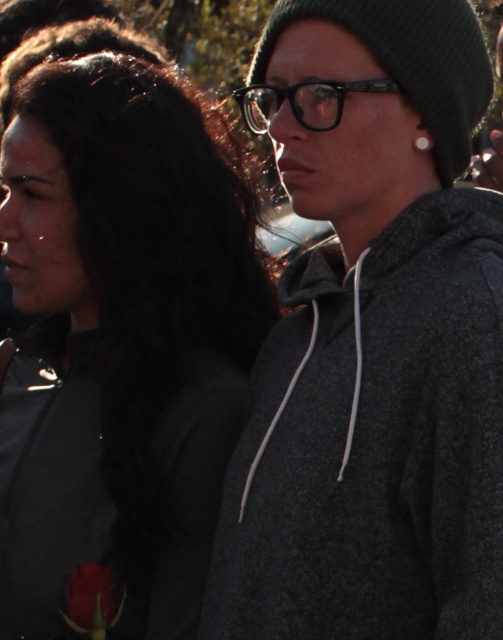
You are a photographer adjusting your camera settings to capture the matte red rose at lower left and the silver metallic earring at upper center in the same frame. Given their distance apart, will you need to adjust the zoom to ensure both are fully visible without cropping?

The matte red rose at lower left and silver metallic earring at upper center are 6.20 feet apart. To capture both in the same frame without cropping, the photographer may need to adjust the zoom to a wider angle to accommodate the distance between them.

You are a photographer adjusting your camera to focus on the silver metallic earring at upper center. You notice the matte red rose at lower left in the frame. Which object is positioned further to the left?

The matte red rose at lower left is positioned further to the left than the silver metallic earring at upper center.

You are a photographer trying to capture a closeup of the silver metallic earring at upper center and the dark gray fleece hoodie at right. Since you want to focus on the earring, which object should you zoom in on more to ensure it stays in focus while the hoodie becomes slightly blurred?

The silver metallic earring at upper center is smaller than the dark gray fleece hoodie at right, so to keep the earring in focus while blurring the hoodie, you should zoom in more on the silver metallic earring at upper center.